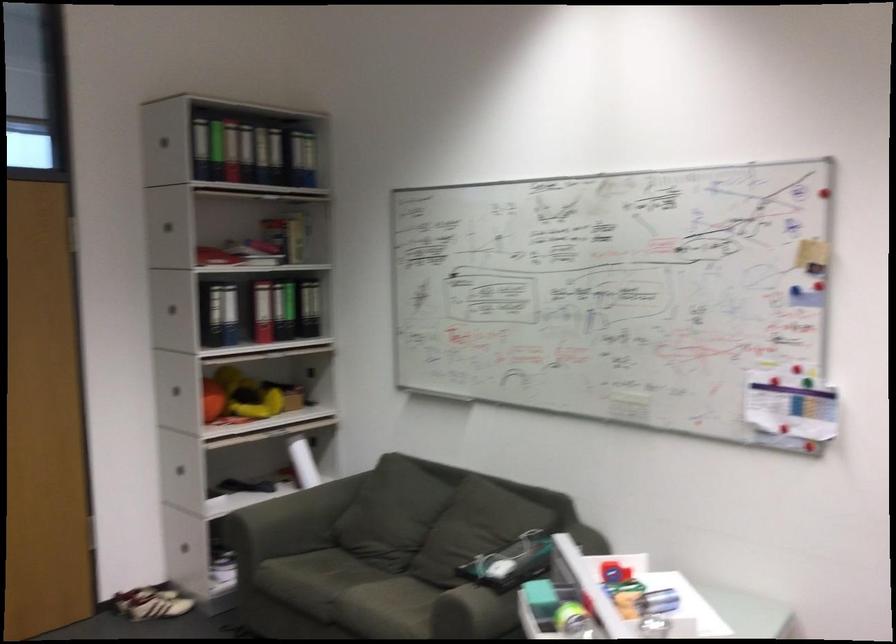
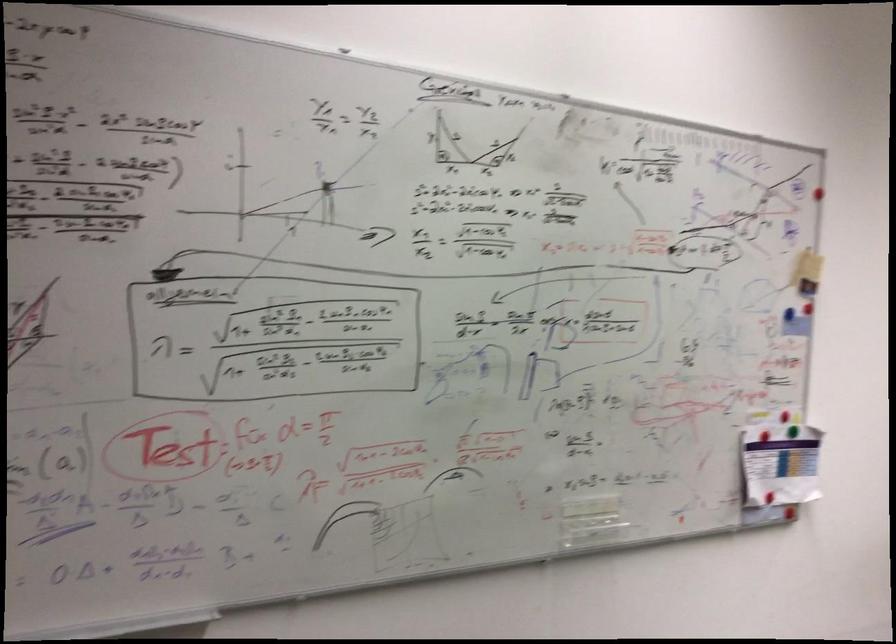
The point at (780, 404) is marked in the first image. Where is the corresponding point in the second image?

(780, 464)